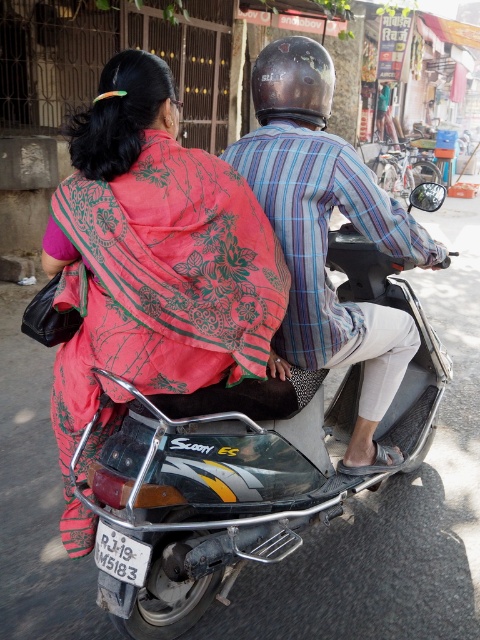
You are a fashion designer observing the two garments in the image. The matte pink saree at center and the striped fabric shirt at center are both part of a new collection. If you need to place them on a mannequin for a photo shoot, how far apart should you position them to maintain the same spatial relationship as in the original image?

The matte pink saree at center should be placed 48.71 centimeters away from the striped fabric shirt at center to maintain the same spatial relationship as in the original image.

You are a delivery person who needs to attach a GPS tracker to the scooter. The GPS tracker must be placed in front of the license plate. According to the coordinates provided, which point should you choose between point (97, 129) and point (328, 134)?

Point (97, 129) is in front of point (328, 134), so you should choose point (97, 129) to place the GPS tracker in front of the license plate.

You are a fashion designer observing a scene where a metallic silver scooter at center and a matte pink saree at center are present. Which object is positioned to the right side?

The metallic silver scooter at center is positioned to the right of the matte pink saree at center.